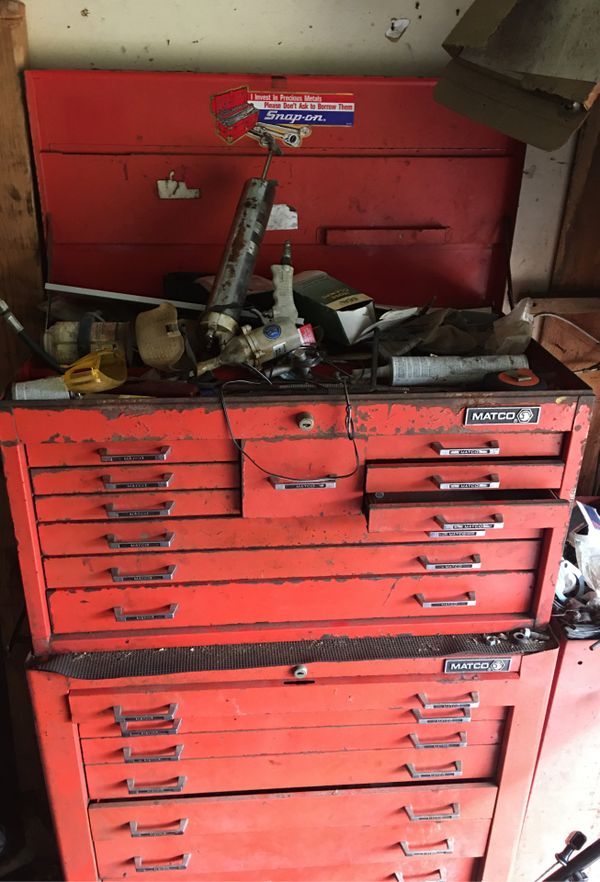
This screenshot has height=882, width=600. Find the location of `wall`. wall is located at coordinates (243, 39).